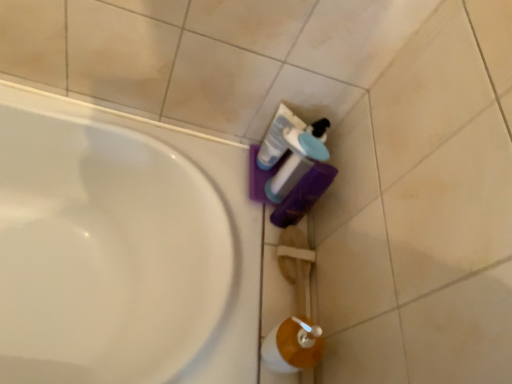
Question: Can you confirm if translucent plastic bottle at lower right is positioned to the left of white glossy mouthwash at center?

Choices:
 (A) yes
 (B) no

Answer: (B)

Question: Considering the relative sizes of translucent plastic bottle at lower right and white glossy mouthwash at center in the image provided, is translucent plastic bottle at lower right wider than white glossy mouthwash at center?

Choices:
 (A) no
 (B) yes

Answer: (B)

Question: Is translucent plastic bottle at lower right bigger than white glossy mouthwash at center?

Choices:
 (A) yes
 (B) no

Answer: (A)

Question: Is translucent plastic bottle at lower right at the right side of white glossy mouthwash at center?

Choices:
 (A) no
 (B) yes

Answer: (B)

Question: Is translucent plastic bottle at lower right located outside white glossy mouthwash at center?

Choices:
 (A) no
 (B) yes

Answer: (B)

Question: Considering the relative sizes of translucent plastic bottle at lower right and white glossy mouthwash at center in the image provided, is translucent plastic bottle at lower right thinner than white glossy mouthwash at center?

Choices:
 (A) yes
 (B) no

Answer: (B)

Question: Is white glossy mouthwash at center shorter than translucent plastic bottle at lower right?

Choices:
 (A) yes
 (B) no

Answer: (A)

Question: Is white glossy mouthwash at center outside of translucent plastic bottle at lower right?

Choices:
 (A) no
 (B) yes

Answer: (B)

Question: Is white glossy mouthwash at center positioned behind translucent plastic bottle at lower right?

Choices:
 (A) no
 (B) yes

Answer: (B)

Question: Considering the relative sizes of white glossy mouthwash at center and translucent plastic bottle at lower right in the image provided, is white glossy mouthwash at center taller than translucent plastic bottle at lower right?

Choices:
 (A) yes
 (B) no

Answer: (B)

Question: From a real-world perspective, is white glossy mouthwash at center over translucent plastic bottle at lower right?

Choices:
 (A) yes
 (B) no

Answer: (B)

Question: Does white glossy mouthwash at center lie in front of translucent plastic bottle at lower right?

Choices:
 (A) yes
 (B) no

Answer: (B)

Question: Considering the positions of translucent plastic bottle at lower right and white glossy mouthwash at center in the image, is translucent plastic bottle at lower right taller or shorter than white glossy mouthwash at center?

Choices:
 (A) tall
 (B) short

Answer: (A)